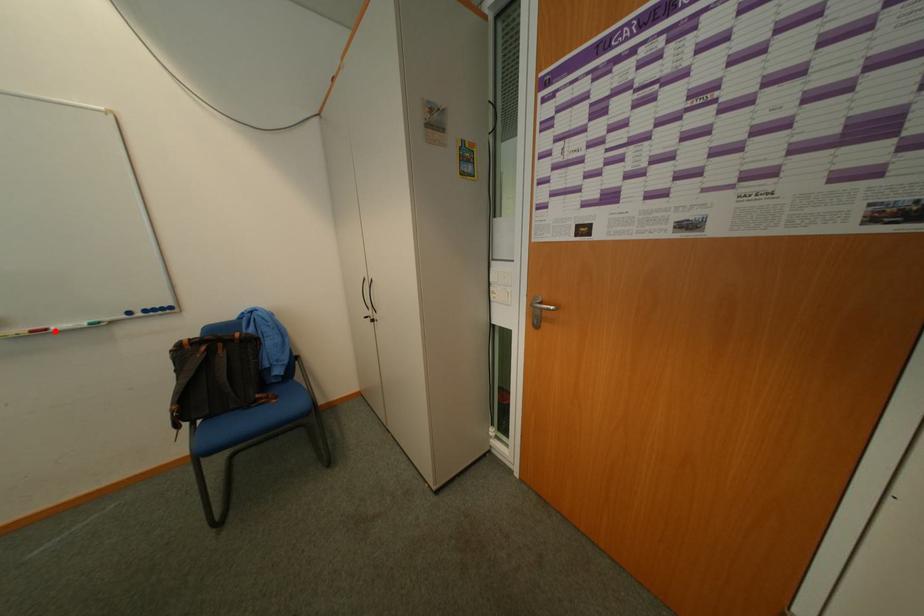
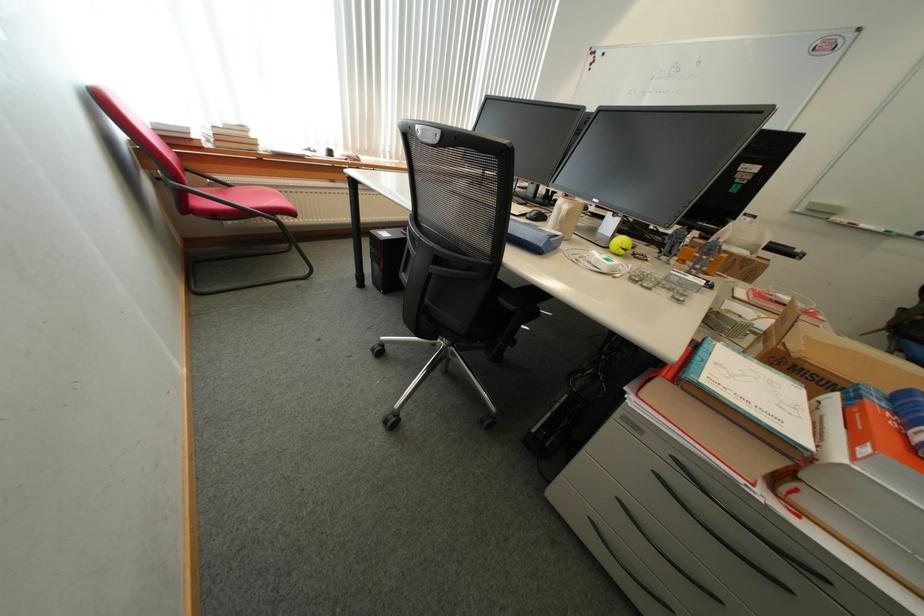
Question: I am providing you with two images of the same scene from different viewpoints. In image1, a red point is highlighted. Considering the same 3D point in image2, which of the following is correct?

Choices:
 (A) It is closer
 (B) It is farther

Answer: (B)